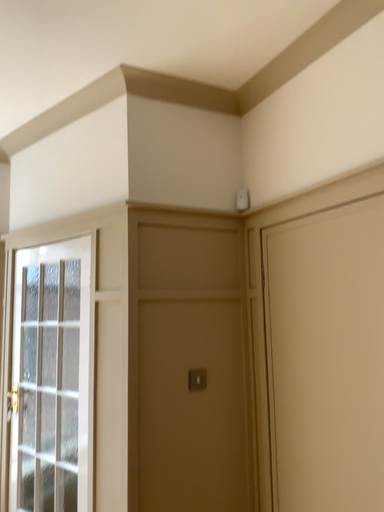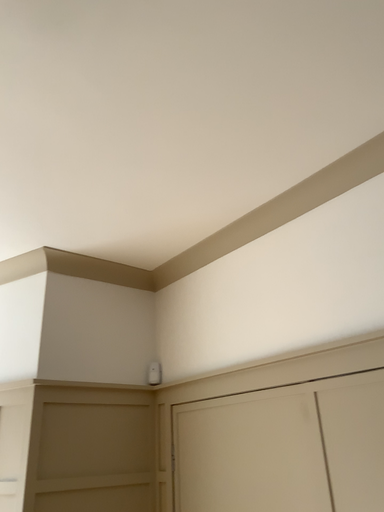
Question: How did the camera likely rotate when shooting the video?

Choices:
 (A) rotated left
 (B) rotated right

Answer: (B)